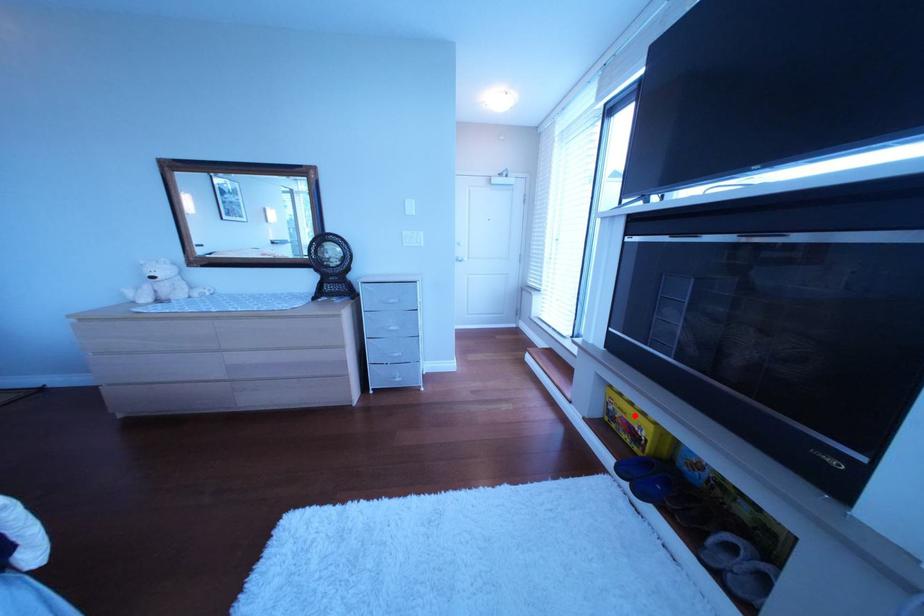
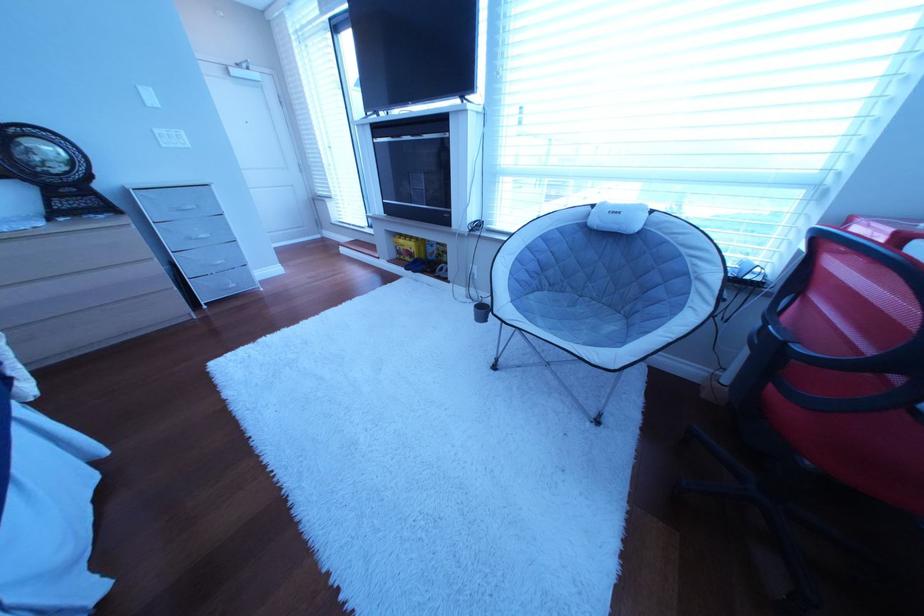
Find the pixel in the second image that matches the highlighted location in the first image.

(418, 251)